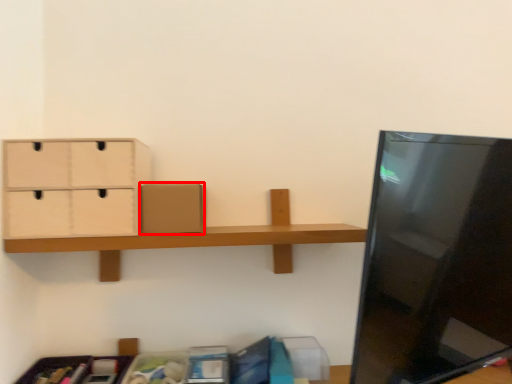
Question: From the image's perspective, where is cardboard box (annotated by the red box) located relative to drawer?

Choices:
 (A) below
 (B) above

Answer: (A)